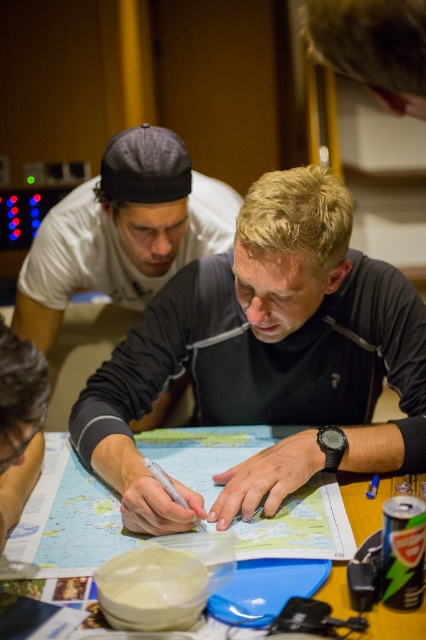
Is black matte shirt at upper center positioned before smooth wooden pen at lower left?

No, it is behind smooth wooden pen at lower left.

What do you see at coordinates (123, 230) in the screenshot? The image size is (426, 640). I see `black matte shirt at upper center` at bounding box center [123, 230].

This screenshot has width=426, height=640. Describe the element at coordinates (123, 230) in the screenshot. I see `black matte shirt at upper center` at that location.

Find the location of a particular element. The width and height of the screenshot is (426, 640). black matte shirt at upper center is located at coordinates (123, 230).

Between smooth wooden pen at lower left and wooden table at center, which one appears on the left side from the viewer's perspective?

smooth wooden pen at lower left is more to the left.

Does smooth wooden pen at lower left appear over wooden table at center?

Yes.

Does point (14, 435) come behind point (408, 634)?

That is False.

Locate an element on the screen. The height and width of the screenshot is (640, 426). smooth wooden pen at lower left is located at coordinates (19, 406).

Is black matte shirt at center below black matte shirt at upper center?

Yes, black matte shirt at center is below black matte shirt at upper center.

This screenshot has height=640, width=426. Describe the element at coordinates (267, 346) in the screenshot. I see `black matte shirt at center` at that location.

Based on the photo, who is more distant from viewer, [241,419] or [94,211]?

The point [94,211] is behind.

Locate an element on the screen. This screenshot has height=640, width=426. black matte shirt at center is located at coordinates (267, 346).